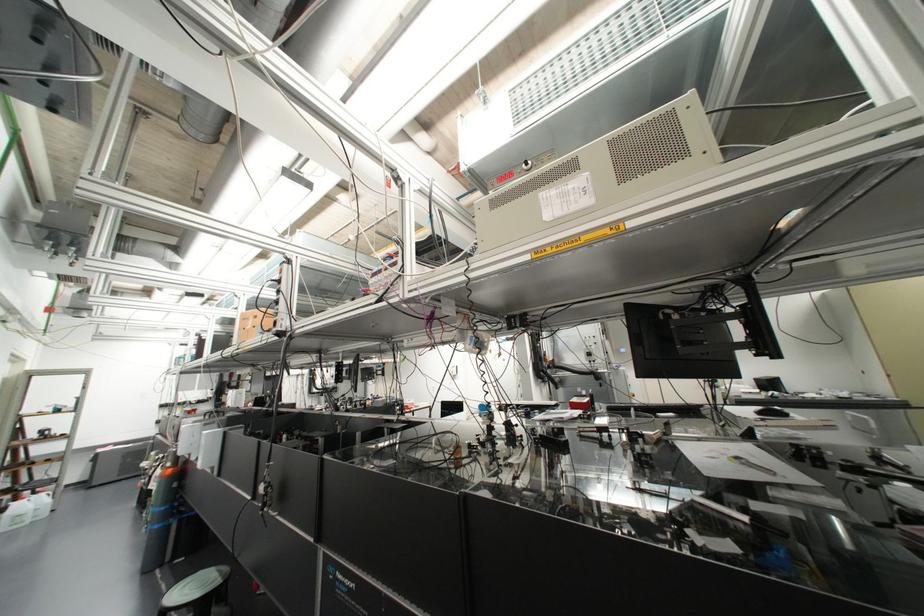
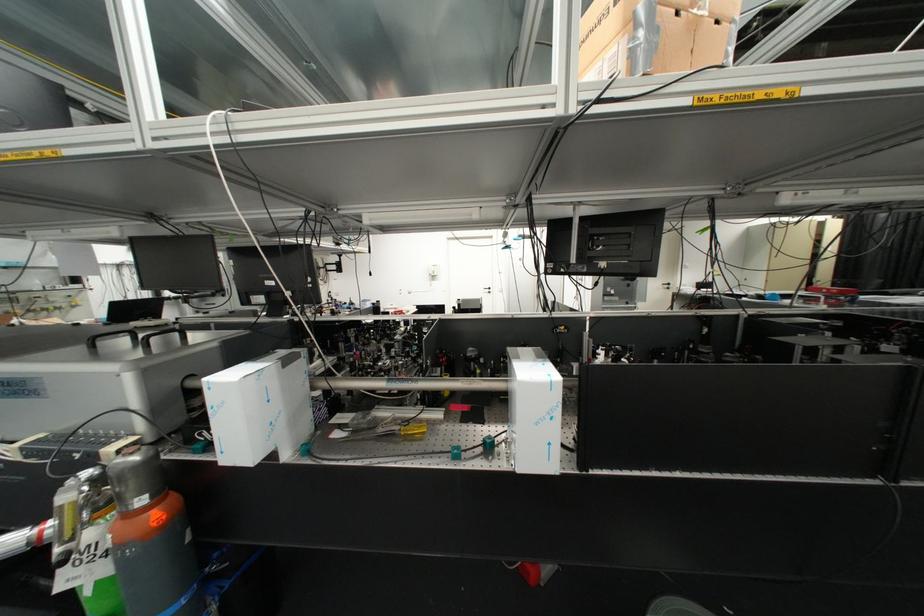
The point at (168,464) is marked in the first image. Where is the corresponding point in the second image?

(140, 500)